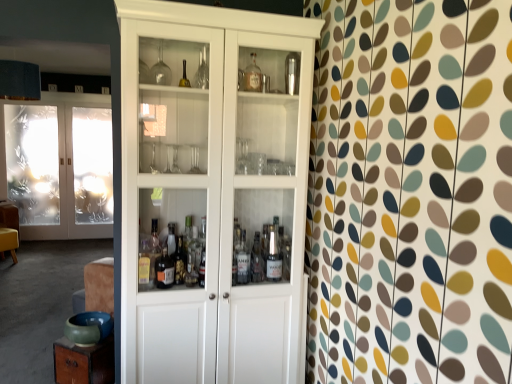
Question: Can you confirm if transparent plastic screen door at left is positioned to the left of frosted glass doors at left?

Choices:
 (A) no
 (B) yes

Answer: (A)

Question: Considering the relative sizes of transparent plastic screen door at left and frosted glass doors at left in the image provided, is transparent plastic screen door at left smaller than frosted glass doors at left?

Choices:
 (A) no
 (B) yes

Answer: (B)

Question: Does transparent plastic screen door at left have a lesser height compared to frosted glass doors at left?

Choices:
 (A) no
 (B) yes

Answer: (B)

Question: Is transparent plastic screen door at left positioned far away from frosted glass doors at left?

Choices:
 (A) no
 (B) yes

Answer: (A)

Question: Is transparent plastic screen door at left positioned behind frosted glass doors at left?

Choices:
 (A) no
 (B) yes

Answer: (B)

Question: Does point (37, 155) appear closer or farther from the camera than point (108, 127)?

Choices:
 (A) closer
 (B) farther

Answer: (A)

Question: From the image's perspective, relative to transparent plastic screen door at left, is frosted glass doors at left above or below?

Choices:
 (A) below
 (B) above

Answer: (A)

Question: Considering the positions of frosted glass doors at left and transparent plastic screen door at left in the image, is frosted glass doors at left bigger or smaller than transparent plastic screen door at left?

Choices:
 (A) big
 (B) small

Answer: (A)

Question: Is frosted glass doors at left taller or shorter than transparent plastic screen door at left?

Choices:
 (A) short
 (B) tall

Answer: (B)

Question: From the image's perspective, is transparent plastic screen door at left above or below frosted glass doors at left?

Choices:
 (A) below
 (B) above

Answer: (B)

Question: Is transparent plastic screen door at left inside the boundaries of frosted glass doors at left, or outside?

Choices:
 (A) inside
 (B) outside

Answer: (B)

Question: From a real-world perspective, is transparent plastic screen door at left physically located above or below frosted glass doors at left?

Choices:
 (A) above
 (B) below

Answer: (A)

Question: Is transparent plastic screen door at left wider or thinner than frosted glass doors at left?

Choices:
 (A) wide
 (B) thin

Answer: (B)

Question: Is transparent plastic screen door at left bigger or smaller than white wood cabinet at center?

Choices:
 (A) big
 (B) small

Answer: (B)

Question: Choose the correct answer: Is transparent plastic screen door at left inside white wood cabinet at center or outside it?

Choices:
 (A) outside
 (B) inside

Answer: (A)